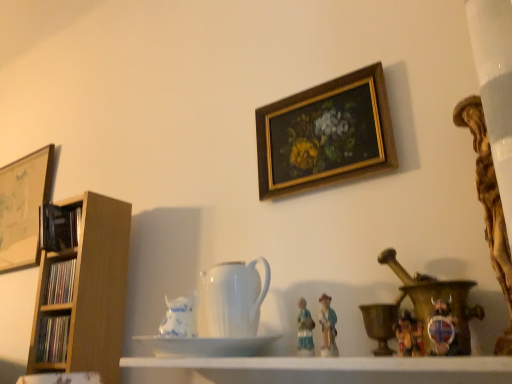
Question: Looking at the image, does matte wooden bookshelf at left, marked as the 1th book in a bottom-to-top arrangement, seem bigger or smaller compared to gold wooden picture frame at upper center, the 1th picture frame when ordered from right to left?

Choices:
 (A) big
 (B) small

Answer: (B)

Question: From a real-world perspective, is matte wooden bookshelf at left, marked as the 1th book in a bottom-to-top arrangement, positioned above or below gold wooden picture frame at upper center, acting as the 2th picture frame starting from the left?

Choices:
 (A) below
 (B) above

Answer: (A)

Question: Which object is the closest to the white porcelain pitcher at center?

Choices:
 (A) white glossy shelf at center
 (B) wooden picture frame at left, placed as the second picture frame when sorted from front to back
 (C) gold wooden picture frame at upper center, acting as the second picture frame starting from the back
 (D) brass/bronze candle holder at right
 (E) wooden bookshelf at left, the 2th book from the bottom

Answer: (A)

Question: Based on their relative distances, which object is nearer to the wooden bookshelf at left, which ranks as the second book in top-to-bottom order?

Choices:
 (A) brass/bronze candle holder at right
 (B) white glossy saucer at center
 (C) white glossy shelf at center
 (D) blue and white porcelain vase at center
 (E) matte wooden bookshelf at left, marked as the 1th book in a bottom-to-top arrangement

Answer: (E)